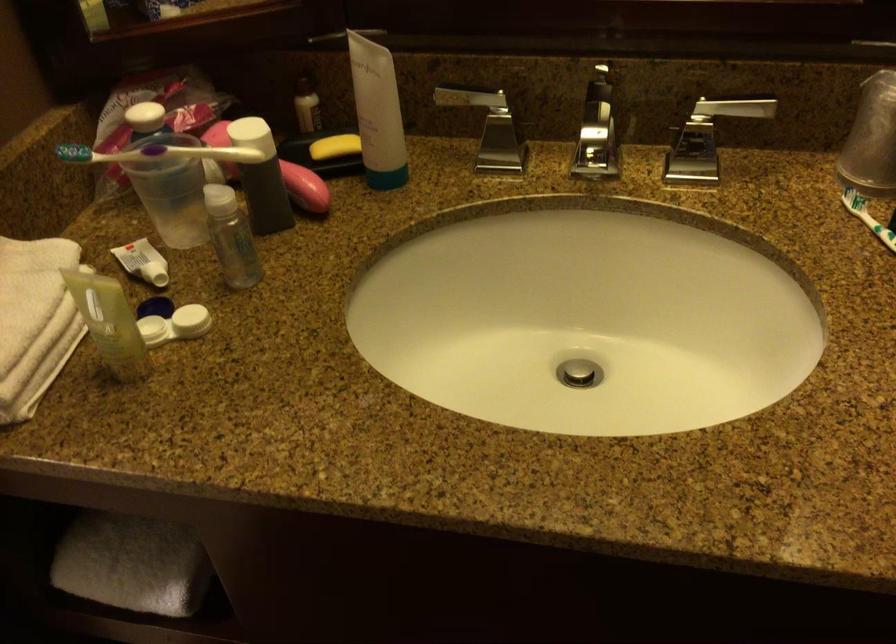
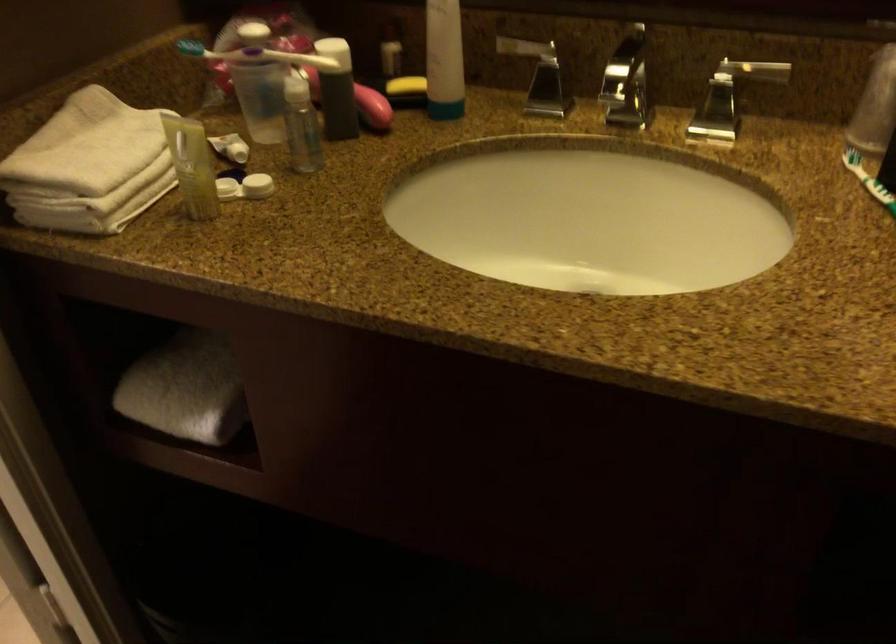
The point at [254,137] is marked in the first image. Where is the corresponding point in the second image?

(334, 52)